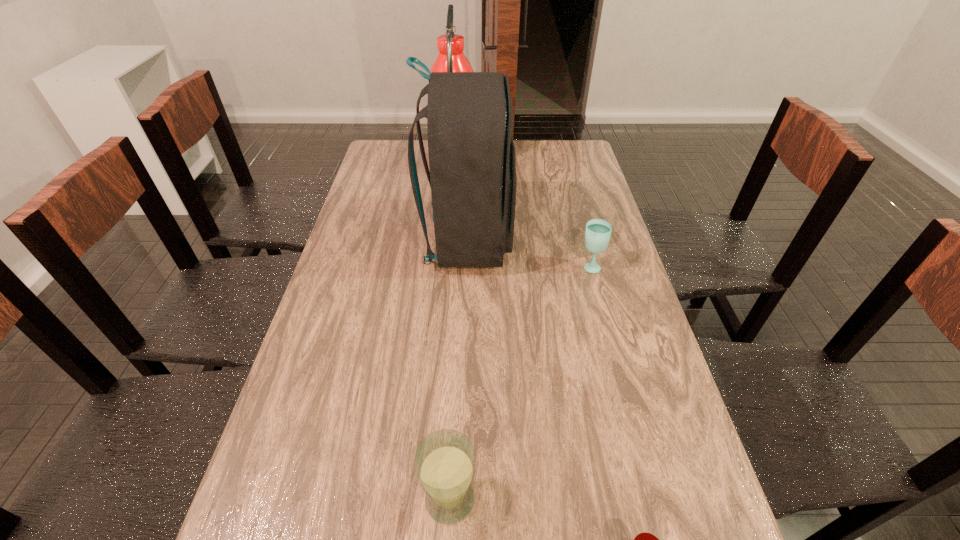
You are a GUI agent. You are given a task and a screenshot of the screen. Output one action in this format:
    pyautogui.click(x=<x>, y=<y>)
    Task: Click on the backpack
    The height and width of the screenshot is (540, 960).
    Given the screenshot: What is the action you would take?
    [x=472, y=161]

Locate an element on the screen. The image size is (960, 540). fire extinguisher is located at coordinates (451, 58).

I want to click on the leftmost glass, so click(445, 461).

The width and height of the screenshot is (960, 540). Find the location of `the second nearest glass`. the second nearest glass is located at coordinates (445, 461).

Locate an element on the screen. the rightmost glass is located at coordinates (598, 231).

The width and height of the screenshot is (960, 540). I want to click on the rightmost object, so click(598, 231).

Where is `vacant space located on the front-facing side of the backpack`? This screenshot has width=960, height=540. vacant space located on the front-facing side of the backpack is located at coordinates click(x=589, y=241).

At what (x,y) coordinates should I click in order to perform the action: click on free space located 0.250m on the label side of the farthest object. Please return your answer as a coordinate pair (x, y). Looking at the image, I should click on (541, 168).

Where is `blank area located on the left of the second nearest glass`? blank area located on the left of the second nearest glass is located at coordinates (278, 500).

Identify the location of free space located on the front of the rightmost object. This screenshot has width=960, height=540. (619, 376).